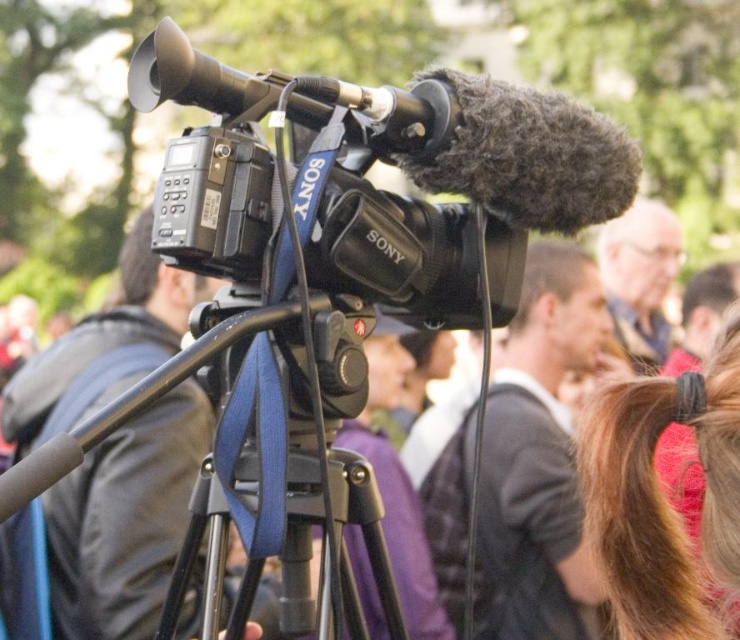
You are standing at the origin point in the image. Which direction should you move to reach the black matte camera at center?

The black matte camera at center is located at coordinates point 0.814 on the x axis and 0.170 on the y axis. Since you are at the origin point, you should move towards the positive x and positive y direction to reach it.

You are a photographer setting up equipment for an outdoor event. You have a black matte camera at center and a blue fabric tripod at center. Which object should you pick up first if you need to adjust the height of the equipment?

You should pick up the blue fabric tripod at center first because the black matte camera at center is larger in size and likely mounted on it, so adjusting the tripod would require accessing it first.